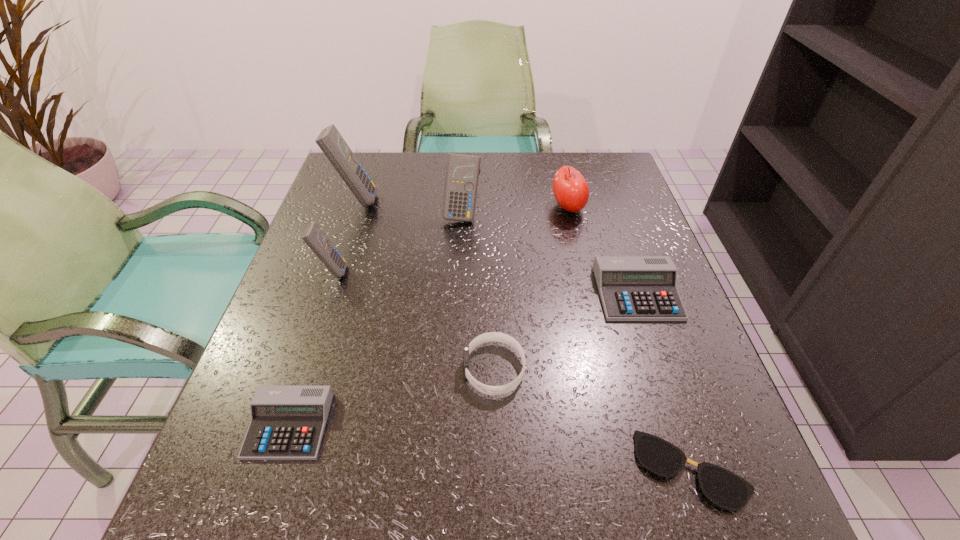
Identify the location of vacant space located on the outer surface of the wristband. The image size is (960, 540). (362, 369).

Where is `free space located 0.220m on the right of the nearer gray calculator`? The image size is (960, 540). free space located 0.220m on the right of the nearer gray calculator is located at coordinates (465, 426).

Image resolution: width=960 pixels, height=540 pixels. I want to click on vacant space located 0.330m on the left of the shortest object, so click(x=415, y=469).

Where is `calculator positioned at the far edge`? calculator positioned at the far edge is located at coordinates (330, 141).

Find the location of a particular element. The image size is (960, 540). apple that is at the far edge is located at coordinates (571, 191).

The height and width of the screenshot is (540, 960). Identify the location of object present at the near edge. (722, 487).

Find the location of a particular element. The image size is (960, 540). apple located at the right edge is located at coordinates (571, 191).

You are a GUI agent. You are given a task and a screenshot of the screen. Output one action in this format:
    pyautogui.click(x=<x>, y=<y>)
    Task: Click on the calculator that is at the right edge
    This screenshot has height=540, width=960.
    Given the screenshot: What is the action you would take?
    click(632, 288)

Find the location of a particular element. Image resolution: width=960 pixels, height=540 pixels. spectacles at the right edge is located at coordinates (722, 487).

Locate an element on the screen. Image resolution: width=960 pixels, height=540 pixels. object at the far left corner is located at coordinates (330, 141).